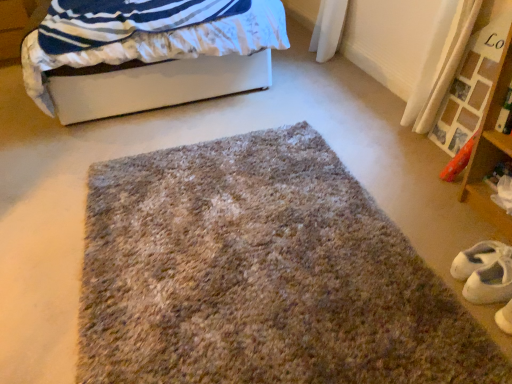
The width and height of the screenshot is (512, 384). I want to click on blank space to the left of wooden shelf at right, so click(x=436, y=223).